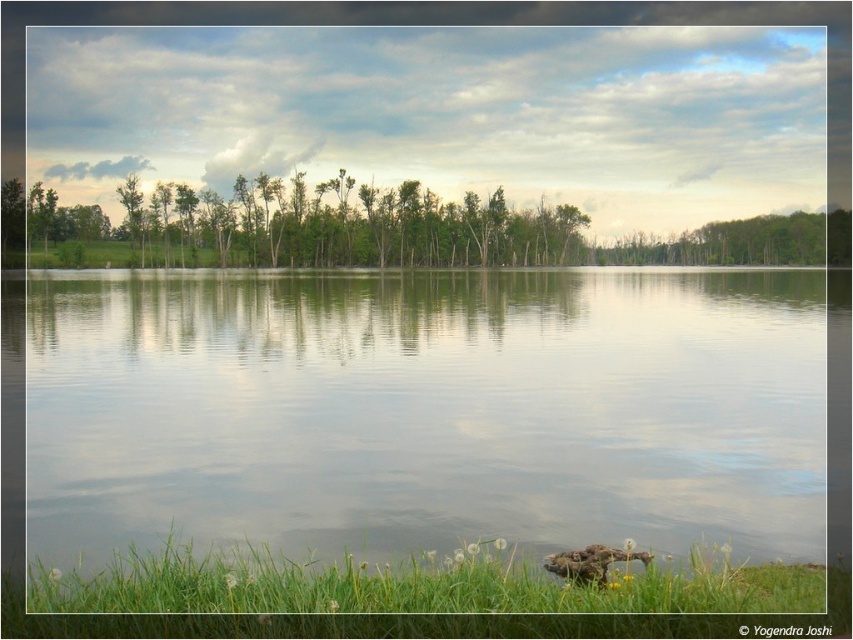
You are standing at the edge of the lake and see the green grass at lower center and the brown fuzzy duck at lower center. If you want to reach the duck without stepping on the grass, what is the minimum distance you need to walk around the grass?

The green grass at lower center is 5.70 feet away from the brown fuzzy duck at lower center. To avoid stepping on the grass, you would need to walk around it, which would require a path that is at least 5.70 feet long.

Looking at this image, you are standing at the edge of the lake and want to walk to the brown fuzzy duck at lower center without stepping into the clear water at center. Is this possible given their widths?

The clear water at center is wider than the brown fuzzy duck at lower center, so you can walk to the duck without stepping into the water by staying on the narrower area near the duck.